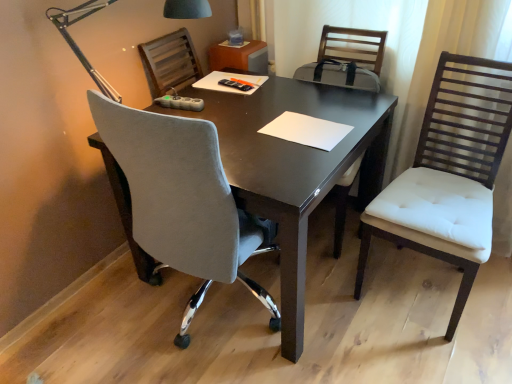
In order to face white tufted cushion chair at right, which is the second chair in left-to-right order, should I rotate leftwards or rightwards?

To face it directly, rotate right by 23.718 degrees.

What is the approximate height of white paper at center?

The height of white paper at center is 1.08 inches.

This screenshot has height=384, width=512. Describe the element at coordinates (181, 199) in the screenshot. I see `velvet grey chair at center, which ranks as the 1th chair in left-to-right order` at that location.

Where is `white tufted armchair at center`? The height and width of the screenshot is (384, 512). white tufted armchair at center is located at coordinates (347, 59).

In the scene shown: Which of these two, white tufted armchair at center or metallic gray lamp at upper left, stands taller?

white tufted armchair at center is taller.

From the image's perspective, is white tufted armchair at center located above or below metallic gray lamp at upper left?

Based on their image positions, white tufted armchair at center is located beneath metallic gray lamp at upper left.

Could you tell me if white tufted armchair at center is facing metallic gray lamp at upper left?

No, white tufted armchair at center is not turned towards metallic gray lamp at upper left.

Is white tufted armchair at center beside metallic gray lamp at upper left?

white tufted armchair at center and metallic gray lamp at upper left are clearly separated.

In the scene shown: Is velvet grey chair at center, which ranks as the 1th chair in left-to-right order, touching metallic gray lamp at upper left?

They are not placed beside each other.

Is velvet grey chair at center, acting as the second chair starting from the right, closer to the viewer compared to metallic gray lamp at upper left?

Yes, velvet grey chair at center, acting as the second chair starting from the right, is closer to the camera.

Can you confirm if velvet grey chair at center, acting as the second chair starting from the right, is positioned to the left of metallic gray lamp at upper left?

No, velvet grey chair at center, acting as the second chair starting from the right, is not to the left of metallic gray lamp at upper left.

How many degrees apart are the facing directions of velvet grey chair at center, which ranks as the 1th chair in left-to-right order, and metallic gray lamp at upper left?

There is a 4.03-degree angle between the facing directions of velvet grey chair at center, which ranks as the 1th chair in left-to-right order, and metallic gray lamp at upper left.

From the image's perspective, which object appears higher, white paper at center or white tufted armchair at center?

white paper at center appears higher in the image.

The image size is (512, 384). Find the location of `armchair that appears on the right of white paper at center`. armchair that appears on the right of white paper at center is located at coordinates (347, 59).

Does white paper at center appear on the right side of white tufted armchair at center?

In fact, white paper at center is to the left of white tufted armchair at center.

Between white paper at center and white tufted armchair at center, which one has smaller width?

white paper at center is thinner.

From the picture: Could you measure the distance between velvet grey chair at center, acting as the second chair starting from the right, and white tufted armchair at center?

velvet grey chair at center, acting as the second chair starting from the right, is 38.43 inches away from white tufted armchair at center.

The width and height of the screenshot is (512, 384). I want to click on armchair behind the velvet grey chair at center, which ranks as the 1th chair in left-to-right order, so (347, 59).

In the image, is velvet grey chair at center, which ranks as the 1th chair in left-to-right order, on the left side or the right side of white tufted armchair at center?

velvet grey chair at center, which ranks as the 1th chair in left-to-right order, is positioned on white tufted armchair at center's left side.

Consider the image. Between velvet grey chair at center, acting as the second chair starting from the right, and white tufted armchair at center, which one has more height?

white tufted armchair at center is taller.

Is metallic gray lamp at upper left beside white paper at center?

No, metallic gray lamp at upper left is not beside white paper at center.

From the image's perspective, which is above, metallic gray lamp at upper left or white paper at center?

From the image's view, metallic gray lamp at upper left is above.

Is metallic gray lamp at upper left to the left or to the right of white paper at center in the image?

Clearly, metallic gray lamp at upper left is on the left of white paper at center in the image.

Consider the image. Can you confirm if metallic gray lamp at upper left is positioned to the left of white tufted armchair at center?

Yes.

Is the depth of metallic gray lamp at upper left greater than that of white tufted armchair at center?

No, it is in front of white tufted armchair at center.

Locate an element on the screen. This screenshot has width=512, height=384. armchair on the right of metallic gray lamp at upper left is located at coordinates (347, 59).

Between point (377, 35) and point (89, 93), which one is positioned behind?

The point (377, 35) is behind.

How many degrees apart are the facing directions of white tufted armchair at center and velvet grey chair at center, acting as the second chair starting from the right?

They differ by 90.3 degrees in their facing directions.

From the picture: Considering the relative sizes of white tufted armchair at center and velvet grey chair at center, which ranks as the 1th chair in left-to-right order, in the image provided, is white tufted armchair at center taller than velvet grey chair at center, which ranks as the 1th chair in left-to-right order,?

Yes.

Considering the sizes of objects white tufted armchair at center and velvet grey chair at center, which ranks as the 1th chair in left-to-right order, in the image provided, who is thinner, white tufted armchair at center or velvet grey chair at center, which ranks as the 1th chair in left-to-right order,?

white tufted armchair at center is thinner.

Image resolution: width=512 pixels, height=384 pixels. I want to click on armchair on the right of metallic gray lamp at upper left, so click(347, 59).

This screenshot has height=384, width=512. Identify the location of lamp above the velvet grey chair at center, acting as the second chair starting from the right (from a real-world perspective). (77, 45).

When comparing their distances from white paper at center, does velvet grey chair at center, acting as the second chair starting from the right, or metallic gray lamp at upper left seem closer?

Among the two, velvet grey chair at center, acting as the second chair starting from the right, is located nearer to white paper at center.

Considering their positions, is white tufted armchair at center positioned closer to white tufted cushion chair at right, acting as the 1th chair starting from the right, than white paper at center?

The object closer to white tufted cushion chair at right, acting as the 1th chair starting from the right, is white paper at center.

From the image, which object appears to be farther from velvet grey chair at center, which ranks as the 1th chair in left-to-right order, white paper at center or white tufted cushion chair at right, acting as the 1th chair starting from the right?

white tufted cushion chair at right, acting as the 1th chair starting from the right, is positioned further to the anchor velvet grey chair at center, which ranks as the 1th chair in left-to-right order.

Which object lies further to the anchor point white paper at center, metallic gray lamp at upper left or velvet grey chair at center, which ranks as the 1th chair in left-to-right order?

metallic gray lamp at upper left is positioned further to the anchor white paper at center.

When comparing their distances from metallic gray lamp at upper left, does white tufted armchair at center or white paper at center seem further?

white tufted armchair at center lies further to metallic gray lamp at upper left than the other object.

When comparing their distances from velvet grey chair at center, acting as the second chair starting from the right, does white tufted armchair at center or white tufted cushion chair at right, acting as the 1th chair starting from the right, seem closer?

white tufted cushion chair at right, acting as the 1th chair starting from the right, is positioned closer to the anchor velvet grey chair at center, acting as the second chair starting from the right.

Considering their positions, is velvet grey chair at center, acting as the second chair starting from the right, positioned closer to white paper at center than white tufted cushion chair at right, which is the second chair in left-to-right order?

velvet grey chair at center, acting as the second chair starting from the right, lies closer to white paper at center than the other object.

Looking at the image, which one is located further to white paper at center, metallic gray lamp at upper left or white tufted armchair at center?

Among the two, metallic gray lamp at upper left is located further to white paper at center.

At what (x,y) coordinates should I click in order to perform the action: click on notepad located between velvet grey chair at center, acting as the second chair starting from the right, and white tufted cushion chair at right, which is the second chair in left-to-right order, in the left-right direction. Please return your answer as a coordinate pair (x, y). Looking at the image, I should click on (306, 130).

At what (x,y) coordinates should I click in order to perform the action: click on armchair between velvet grey chair at center, which ranks as the 1th chair in left-to-right order, and white tufted cushion chair at right, which is the second chair in left-to-right order, in the horizontal direction. Please return your answer as a coordinate pair (x, y). Image resolution: width=512 pixels, height=384 pixels. Looking at the image, I should click on (347, 59).

Where is `armchair situated between white paper at center and white tufted cushion chair at right, which is the second chair in left-to-right order, from left to right`? Image resolution: width=512 pixels, height=384 pixels. armchair situated between white paper at center and white tufted cushion chair at right, which is the second chair in left-to-right order, from left to right is located at coordinates (347, 59).

Locate an element on the screen. notepad positioned between velvet grey chair at center, acting as the second chair starting from the right, and white tufted armchair at center from near to far is located at coordinates point(306,130).